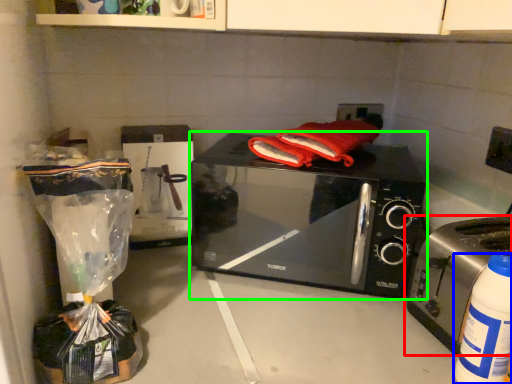
Question: Which object is positioned closest to toaster (highlighted by a red box)? Select from bottle (highlighted by a blue box) and microwave oven (highlighted by a green box).

Choices:
 (A) bottle
 (B) microwave oven

Answer: (A)